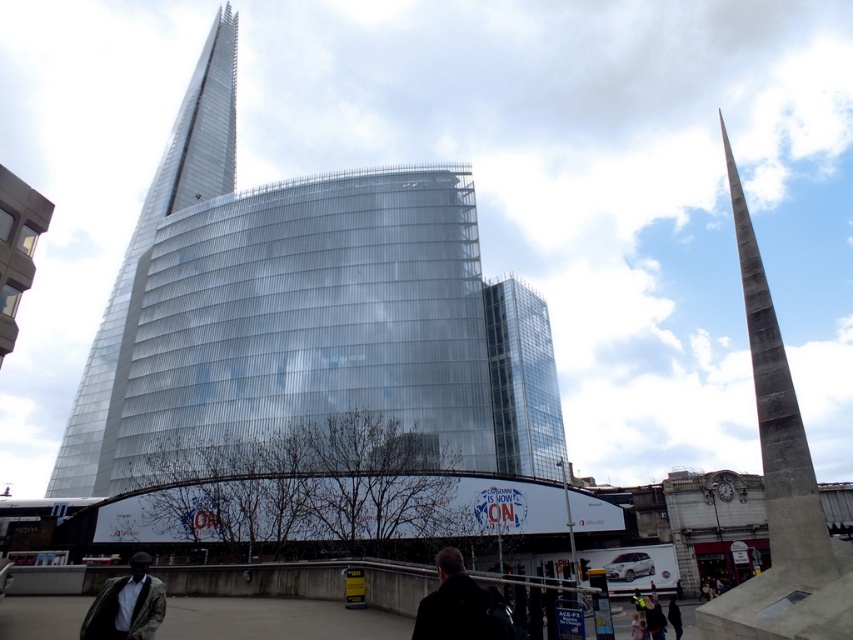
You are standing in the pedestrian area at the base of the buildings. There are two points marked on the ground in front of you. One is at point (x=447, y=548) and the other is at point (x=109, y=600). Which point is closer to you?

Point (x=447, y=548) is closer to you because it is further to the viewer than point (x=109, y=600).

You are a city planner reviewing the urban layout. You need to place a new bench exactly at point (780, 486). However, there is an object already there. What is the object located at this coordinate?

The object located at point (780, 486) is the concrete obelisk at right.

Consider the image. You are a delivery drone with a maximum flight range of 25 meters. You need to deliver a package from the concrete obelisk at right to the dark brown leather jacket at lower center. Can you complete the delivery without recharging?

The distance between the concrete obelisk at right and the dark brown leather jacket at lower center is 22.58 meters, which is within your 25 meter range. Yes, you can complete the delivery without recharging.